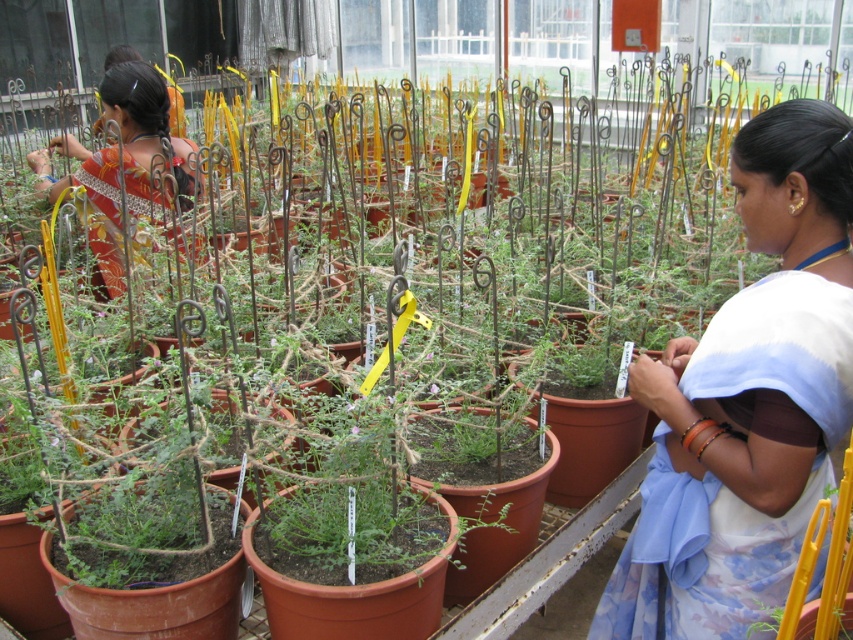
Is point (717, 547) in front of point (132, 198)?

Yes, point (717, 547) is in front of point (132, 198).

Is point (743, 330) closer to camera compared to point (178, 145)?

Yes, point (743, 330) is closer to viewer.

Where is `white cotton saree at center`? The height and width of the screenshot is (640, 853). white cotton saree at center is located at coordinates (747, 400).